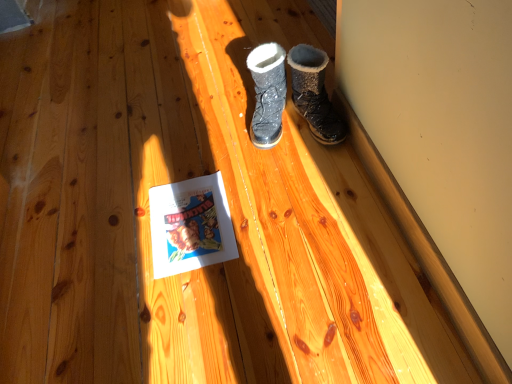
This screenshot has width=512, height=384. Describe the element at coordinates (314, 94) in the screenshot. I see `dark brown suede boot at upper right, which appears as the first footwear when viewed from the right` at that location.

Find the location of a particular element. The width and height of the screenshot is (512, 384). white paper at center is located at coordinates (190, 225).

Describe the element at coordinates (190, 225) in the screenshot. I see `white paper at center` at that location.

The width and height of the screenshot is (512, 384). What are the coordinates of `sparkly black boot at center, which is the second footwear in right-to-left order` in the screenshot? It's located at (267, 93).

Find the location of a particular element. The height and width of the screenshot is (384, 512). dark brown suede boot at upper right, which ranks as the 2th footwear in left-to-right order is located at coordinates click(x=314, y=94).

Does white paper at center turn towards dark brown suede boot at upper right, which appears as the first footwear when viewed from the right?

No, white paper at center is not aimed at dark brown suede boot at upper right, which appears as the first footwear when viewed from the right.

Is white paper at center to the left of dark brown suede boot at upper right, which appears as the first footwear when viewed from the right, from the viewer's perspective?

Yes.

How far apart are white paper at center and dark brown suede boot at upper right, which appears as the first footwear when viewed from the right?

They are 16.77 inches apart.

You are a GUI agent. You are given a task and a screenshot of the screen. Output one action in this format:
    pyautogui.click(x=<x>, y=<y>)
    Task: Click on the paperback book that is under the dark brown suede boot at upper right, which ranks as the 2th footwear in left-to-right order (from a real-world perspective)
    
    Given the screenshot: What is the action you would take?
    pyautogui.click(x=190, y=225)

Considering the sizes of sparkly black boot at center, the first footwear from the left, and dark brown suede boot at upper right, which ranks as the 2th footwear in left-to-right order, in the image, is sparkly black boot at center, the first footwear from the left, taller or shorter than dark brown suede boot at upper right, which ranks as the 2th footwear in left-to-right order,?

In the image, sparkly black boot at center, the first footwear from the left, appears to be shorter than dark brown suede boot at upper right, which ranks as the 2th footwear in left-to-right order.

Can you confirm if sparkly black boot at center, the first footwear from the left, is positioned to the left of dark brown suede boot at upper right, which ranks as the 2th footwear in left-to-right order?

Correct, you'll find sparkly black boot at center, the first footwear from the left, to the left of dark brown suede boot at upper right, which ranks as the 2th footwear in left-to-right order.

How different are the orientations of sparkly black boot at center, which is the second footwear in right-to-left order, and dark brown suede boot at upper right, which appears as the first footwear when viewed from the right, in degrees?

They differ by 18.7 degrees in their facing directions.

Is sparkly black boot at center, the first footwear from the left, turned away from dark brown suede boot at upper right, which appears as the first footwear when viewed from the right?

That's not correct — sparkly black boot at center, the first footwear from the left, is not looking away from dark brown suede boot at upper right, which appears as the first footwear when viewed from the right.

In the scene shown: From a real-world perspective, which object stands above the other?

sparkly black boot at center, the first footwear from the left, is physically above.

Is the surface of sparkly black boot at center, the first footwear from the left, in direct contact with white paper at center?

sparkly black boot at center, the first footwear from the left, and white paper at center are clearly separated.

How many degrees apart are the facing directions of sparkly black boot at center, the first footwear from the left, and white paper at center?

sparkly black boot at center, the first footwear from the left, and white paper at center are facing 17 degrees away from each other.

Considering the relative positions of sparkly black boot at center, the first footwear from the left, and white paper at center in the image provided, is sparkly black boot at center, the first footwear from the left, to the left of white paper at center from the viewer's perspective?

No, sparkly black boot at center, the first footwear from the left, is not to the left of white paper at center.

From a real-world perspective, is dark brown suede boot at upper right, which ranks as the 2th footwear in left-to-right order, on white paper at center?

Yes, from a real-world perspective, dark brown suede boot at upper right, which ranks as the 2th footwear in left-to-right order, is over white paper at center

Considering the sizes of dark brown suede boot at upper right, which ranks as the 2th footwear in left-to-right order, and white paper at center in the image, is dark brown suede boot at upper right, which ranks as the 2th footwear in left-to-right order, taller or shorter than white paper at center?

In the image, dark brown suede boot at upper right, which ranks as the 2th footwear in left-to-right order, appears to be taller than white paper at center.

Find the location of a particular element. The height and width of the screenshot is (384, 512). paperback book in front of the dark brown suede boot at upper right, which ranks as the 2th footwear in left-to-right order is located at coordinates (190, 225).

From the picture: Would you consider dark brown suede boot at upper right, which ranks as the 2th footwear in left-to-right order, to be distant from sparkly black boot at center, the first footwear from the left?

No, dark brown suede boot at upper right, which ranks as the 2th footwear in left-to-right order, is not far from sparkly black boot at center, the first footwear from the left.

Can you confirm if dark brown suede boot at upper right, which appears as the first footwear when viewed from the right, is shorter than sparkly black boot at center, which is the second footwear in right-to-left order?

In fact, dark brown suede boot at upper right, which appears as the first footwear when viewed from the right, may be taller than sparkly black boot at center, which is the second footwear in right-to-left order.

Which of these two, dark brown suede boot at upper right, which appears as the first footwear when viewed from the right, or sparkly black boot at center, which is the second footwear in right-to-left order, is smaller?

sparkly black boot at center, which is the second footwear in right-to-left order, is smaller.

Considering the points (310, 61) and (274, 44), which point is in front, point (310, 61) or point (274, 44)?

Point (310, 61)

In the image, is white paper at center on the left side or the right side of sparkly black boot at center, which is the second footwear in right-to-left order?

white paper at center is positioned on sparkly black boot at center, which is the second footwear in right-to-left order,'s left side.

Considering the positions of point (170, 231) and point (266, 73), is point (170, 231) closer or farther from the camera than point (266, 73)?

Point (170, 231) is positioned closer to the camera compared to point (266, 73).

Measure the distance between white paper at center and sparkly black boot at center, which is the second footwear in right-to-left order.

They are 31.69 centimeters apart.

Starting from the white paper at center, which footwear is the 2nd one to the right? Please provide its 2D coordinates.

[(314, 94)]

Find the location of a particular element. This screenshot has width=512, height=384. footwear above the sparkly black boot at center, the first footwear from the left (from a real-world perspective) is located at coordinates (314, 94).

When comparing their distances from dark brown suede boot at upper right, which ranks as the 2th footwear in left-to-right order, does white paper at center or sparkly black boot at center, which is the second footwear in right-to-left order, seem closer?

sparkly black boot at center, which is the second footwear in right-to-left order, is closer to dark brown suede boot at upper right, which ranks as the 2th footwear in left-to-right order.

Considering their positions, is sparkly black boot at center, which is the second footwear in right-to-left order, positioned closer to white paper at center than dark brown suede boot at upper right, which ranks as the 2th footwear in left-to-right order?

Among the two, sparkly black boot at center, which is the second footwear in right-to-left order, is located nearer to white paper at center.

Based on their spatial positions, is dark brown suede boot at upper right, which ranks as the 2th footwear in left-to-right order, or sparkly black boot at center, the first footwear from the left, closer to white paper at center?

Based on the image, sparkly black boot at center, the first footwear from the left, appears to be nearer to white paper at center.

Consider the image. Which object lies nearer to the anchor point dark brown suede boot at upper right, which appears as the first footwear when viewed from the right, sparkly black boot at center, the first footwear from the left, or white paper at center?

Among the two, sparkly black boot at center, the first footwear from the left, is located nearer to dark brown suede boot at upper right, which appears as the first footwear when viewed from the right.

Based on their spatial positions, is white paper at center or dark brown suede boot at upper right, which appears as the first footwear when viewed from the right, further from sparkly black boot at center, which is the second footwear in right-to-left order?

white paper at center.

When comparing their distances from sparkly black boot at center, the first footwear from the left, does dark brown suede boot at upper right, which ranks as the 2th footwear in left-to-right order, or white paper at center seem closer?

dark brown suede boot at upper right, which ranks as the 2th footwear in left-to-right order, lies closer to sparkly black boot at center, the first footwear from the left, than the other object.

In order to click on footwear that lies between dark brown suede boot at upper right, which appears as the first footwear when viewed from the right, and white paper at center from top to bottom in this screenshot , I will do `click(267, 93)`.